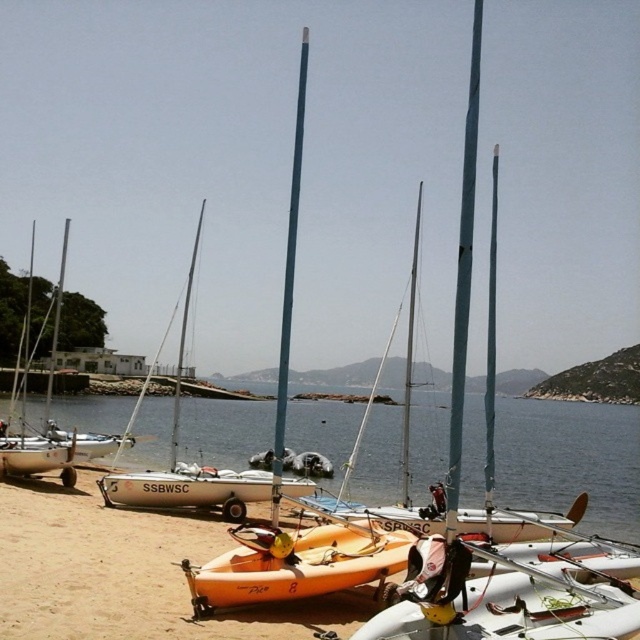
You are standing on the beach and want to take a photo of the orange matte kayak at center. Since the clear blue water at center is in the way, will you need to move forward or backward to get a clear shot of the kayak?

The orange matte kayak at center is behind the clear blue water at center. To get a clear shot of the kayak, you should move forward to position yourself closer to the kayak, as it is located behind the water.

You are standing on the beach looking towards the water. There are two points marked on the sand at coordinates point (248, 584) and point (243, 472). If you want to walk towards the water, which point should you start from to be closer to the shoreline?

You should start from point (248, 584) because it is in front of point (243, 472), meaning it is closer to the shoreline.

You are a photographer planning to capture a shot of the orange matte kayak at center and the white matte boat at center. Since you want to ensure both are fully visible in your frame, which object should you position closer to the camera to avoid cropping?

The orange matte kayak at center is taller than the white matte boat at center, so you should position the orange matte kayak at center closer to the camera to ensure its full height fits within the frame without cropping.